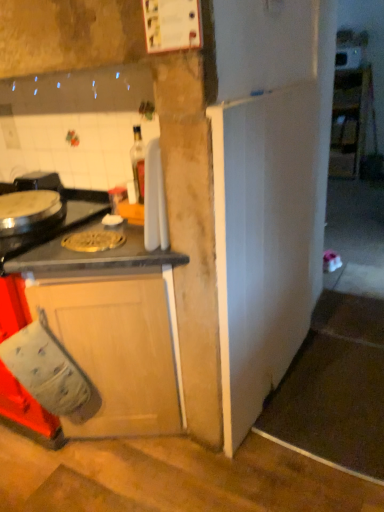
The image size is (384, 512). I want to click on unoccupied area in front of gold metallic pizza pan at center, so click(x=96, y=256).